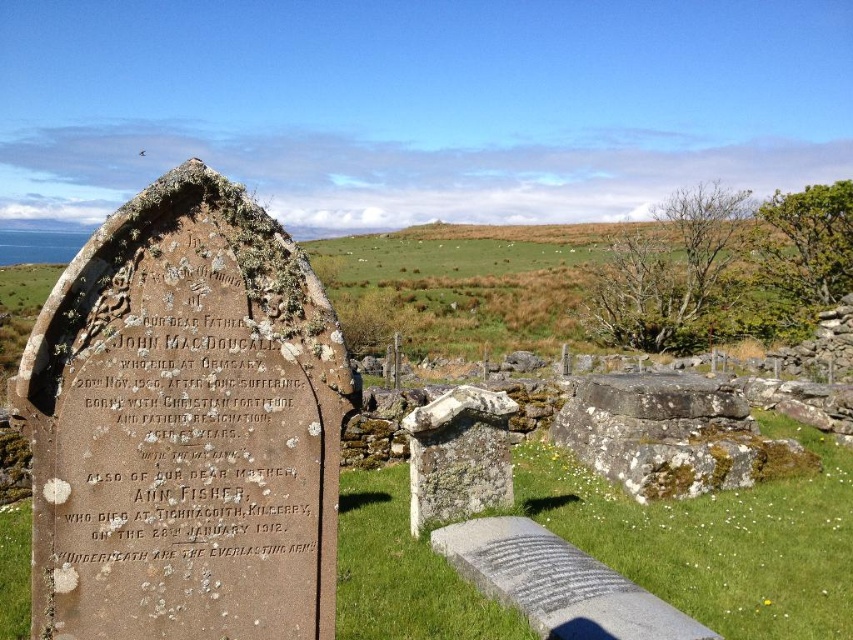
Question: Considering the real-world distances, which object is farthest from the green grass at center?

Choices:
 (A) rough stone gravestone at center
 (B) rusty stone tombstone at left

Answer: (B)

Question: Which point is farther from the camera taking this photo?

Choices:
 (A) (495, 484)
 (B) (715, 529)
 (C) (202, 340)

Answer: (B)

Question: Which of the following is the farthest from the observer?

Choices:
 (A) (363, 564)
 (B) (277, 579)

Answer: (A)

Question: Is green grass at center behind rough stone gravestone at center?

Choices:
 (A) no
 (B) yes

Answer: (B)

Question: Is rusty stone tombstone at left wider than rough stone gravestone at center?

Choices:
 (A) no
 (B) yes

Answer: (B)

Question: Can you confirm if green grass at center is positioned below rough stone gravestone at center?

Choices:
 (A) no
 (B) yes

Answer: (B)